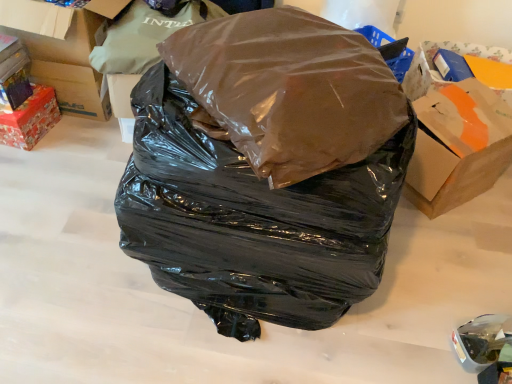
The height and width of the screenshot is (384, 512). What are the coordinates of `vacant space that is to the left of brown matte plastic bag at center, placed as the 1th plastic bag when sorted from bottom to top` in the screenshot? It's located at (69, 240).